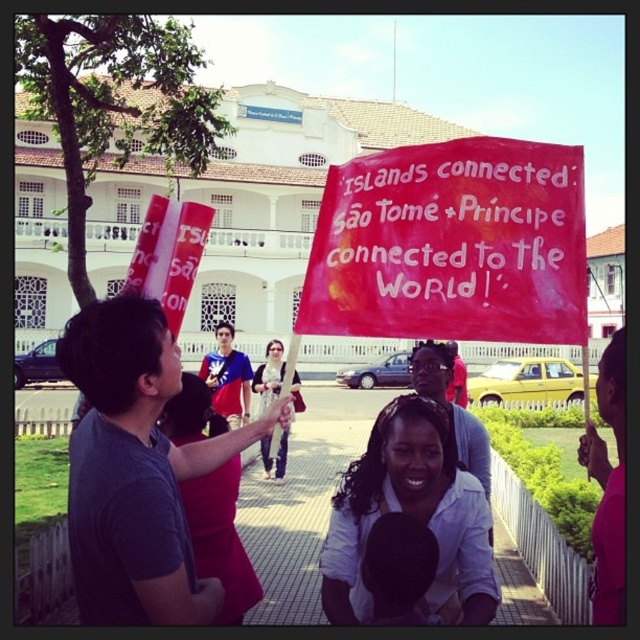
Which is more to the left, red fabric banner at center or matte black shirt at center?

Positioned to the left is matte black shirt at center.

Who is more distant from viewer, (x=364, y=268) or (x=280, y=381)?

The point (x=280, y=381) is behind.

This screenshot has height=640, width=640. I want to click on red fabric banner at center, so click(x=451, y=244).

Which is more to the left, red fabric banner at center or matte red dress at center?

matte red dress at center

Between red fabric banner at center and matte red dress at center, which one is positioned higher?

red fabric banner at center is higher up.

Does point (426, 336) lie behind point (184, 497)?

That is False.

Find the location of a particular element. The width and height of the screenshot is (640, 640). red fabric banner at center is located at coordinates (451, 244).

Can you confirm if matte red dress at center is positioned above matte black shirt at center?

No, matte red dress at center is not above matte black shirt at center.

Does matte red dress at center have a greater height compared to matte black shirt at center?

Indeed, matte red dress at center has a greater height compared to matte black shirt at center.

Does point (192, 508) come in front of point (276, 369)?

Yes, point (192, 508) is in front of point (276, 369).

Where is `matte red dress at center`? The image size is (640, 640). matte red dress at center is located at coordinates (220, 538).